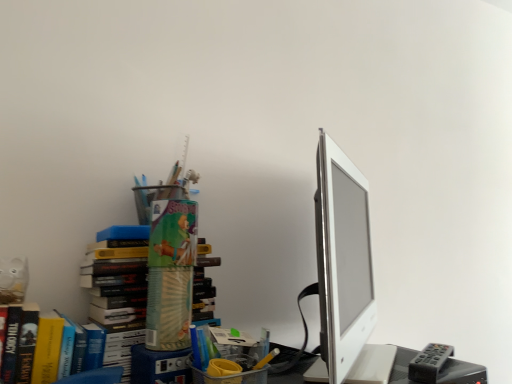
Question: Is gray plastic remote at lower right at the right side of white glossy computer monitor at right?

Choices:
 (A) yes
 (B) no

Answer: (A)

Question: Considering the relative sizes of gray plastic remote at lower right and white glossy computer monitor at right in the image provided, is gray plastic remote at lower right thinner than white glossy computer monitor at right?

Choices:
 (A) no
 (B) yes

Answer: (B)

Question: Is gray plastic remote at lower right wider than white glossy computer monitor at right?

Choices:
 (A) no
 (B) yes

Answer: (A)

Question: Is gray plastic remote at lower right placed right next to white glossy computer monitor at right?

Choices:
 (A) no
 (B) yes

Answer: (A)

Question: Can you confirm if gray plastic remote at lower right is smaller than white glossy computer monitor at right?

Choices:
 (A) no
 (B) yes

Answer: (B)

Question: Relative to gray plastic remote at lower right, is white glossy computer monitor at right in front or behind?

Choices:
 (A) front
 (B) behind

Answer: (A)

Question: Based on their sizes in the image, would you say white glossy computer monitor at right is bigger or smaller than gray plastic remote at lower right?

Choices:
 (A) small
 (B) big

Answer: (B)

Question: Is white glossy computer monitor at right inside the boundaries of gray plastic remote at lower right, or outside?

Choices:
 (A) inside
 (B) outside

Answer: (B)

Question: Is white glossy computer monitor at right taller or shorter than gray plastic remote at lower right?

Choices:
 (A) tall
 (B) short

Answer: (A)

Question: Would you say smooth plastic desk at lower right is inside or outside white glossy computer monitor at right?

Choices:
 (A) outside
 (B) inside

Answer: (A)

Question: Considering the positions of point (415, 352) and point (317, 236), is point (415, 352) closer or farther from the camera than point (317, 236)?

Choices:
 (A) closer
 (B) farther

Answer: (B)

Question: Looking at the image, does smooth plastic desk at lower right seem bigger or smaller compared to white glossy computer monitor at right?

Choices:
 (A) small
 (B) big

Answer: (A)

Question: Is smooth plastic desk at lower right wider or thinner than white glossy computer monitor at right?

Choices:
 (A) wide
 (B) thin

Answer: (A)

Question: Is gray plastic remote at lower right in front of or behind smooth plastic desk at lower right in the image?

Choices:
 (A) front
 (B) behind

Answer: (B)

Question: Is gray plastic remote at lower right wider or thinner than smooth plastic desk at lower right?

Choices:
 (A) thin
 (B) wide

Answer: (A)